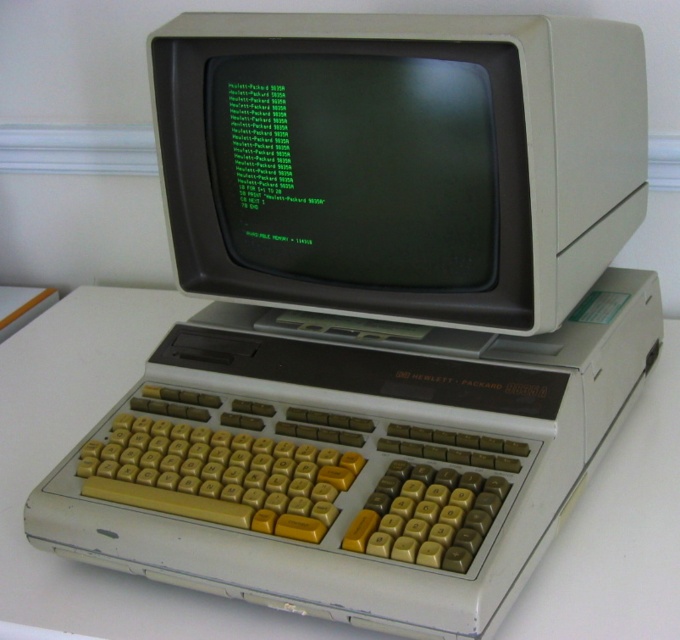
What are the coordinates of the beige plastic monitor at center?

The beige plastic monitor at center is located at coordinates point (401, 161).

You are setting up a display for a retro computing exhibition. You have two monitors, the beige plastic monitor at center and the green matte monitor at center. According to the setup shown in the image, which monitor should be placed on top to replicate the arrangement?

The beige plastic monitor at center should be placed on top of the green matte monitor at center as it is positioned over it in the image.

You are a technician working on the Hewlett Packard 9835A computer. You need to attach a cable to the monitor. The cable is 1.5 inches long. Can you connect the cable between the beige plastic monitor at center and the green matte monitor at center without needing to adjust their positions?

The beige plastic monitor at center is 1.46 inches from green matte monitor at center. Since the cable is 1.5 inches long, which is slightly longer than the distance between them, the cable can be connected without needing to adjust their positions.